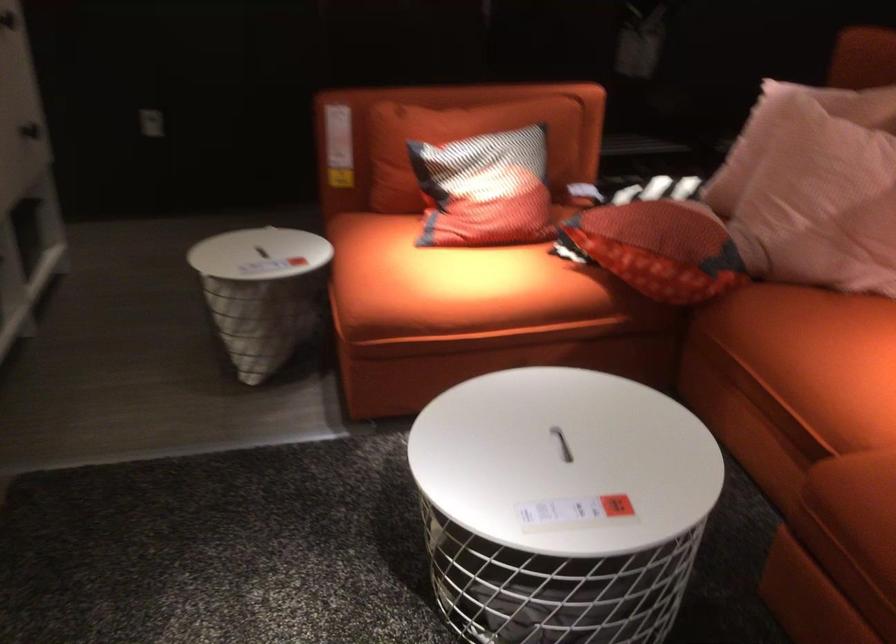
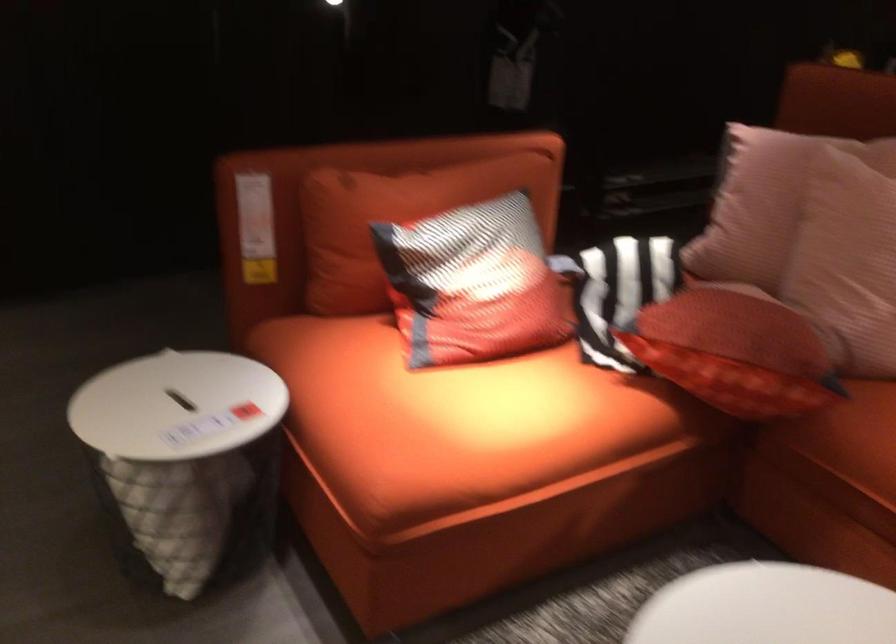
Question: The first image is from the beginning of the video and the second image is from the end. How did the camera likely rotate when shooting the video?

Choices:
 (A) Left
 (B) Right
 (C) Up
 (D) Down

Answer: (B)